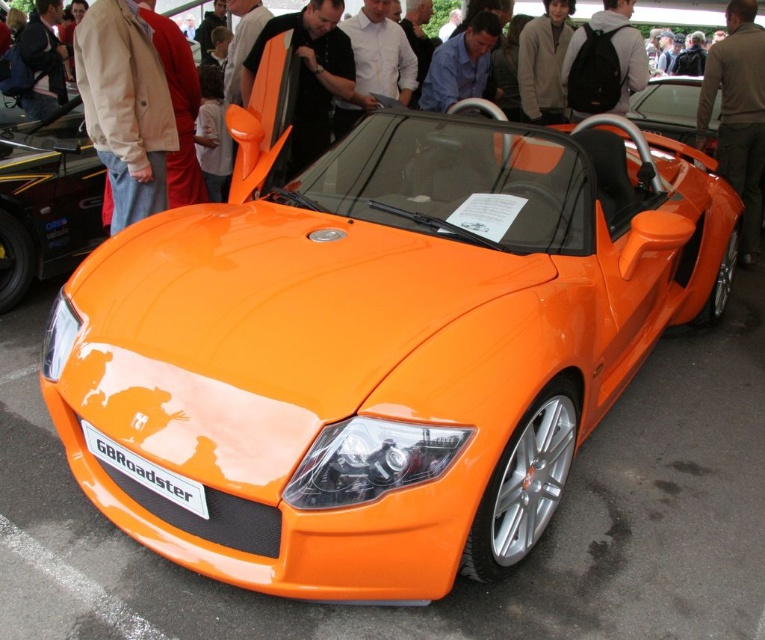
You are organizing a car show and need to place the beige fabric jacket at upper left and the brown leather jacket at center on the car. The car has limited space. Which jacket can you fit without overlapping other items?

The beige fabric jacket at upper left can be placed without overlapping since it occupies less space than the brown leather jacket at center.

You are a customer at a car dealership looking to place your brown leather jacket at center and black backpack at upper center inside the GB Roadster. Based on their thickness, which item would require more space in the car?

The black backpack at upper center requires more space because it is thicker than the brown leather jacket at center.

You are a photographer trying to capture the orange matte sports car at center and the orange matte roadster at center in a single shot. Which one should you focus on first to ensure both are in frame?

The orange matte sports car at center is below the orange matte roadster at center, so you should focus on the orange matte sports car at center first to ensure both are in frame.